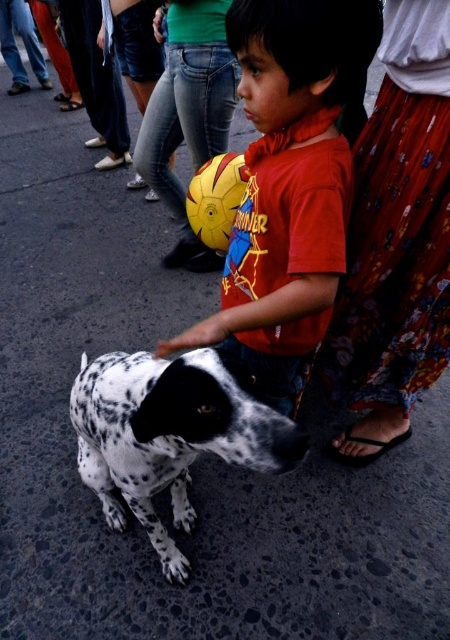
Can you confirm if matte red t-shirt at center is taller than spotted fur dog at lower left?

Indeed, matte red t-shirt at center has a greater height compared to spotted fur dog at lower left.

Is point (322, 337) closer to camera compared to point (220, 365)?

That is False.

Identify the location of matte red t-shirt at center. The width and height of the screenshot is (450, 640). (289, 182).